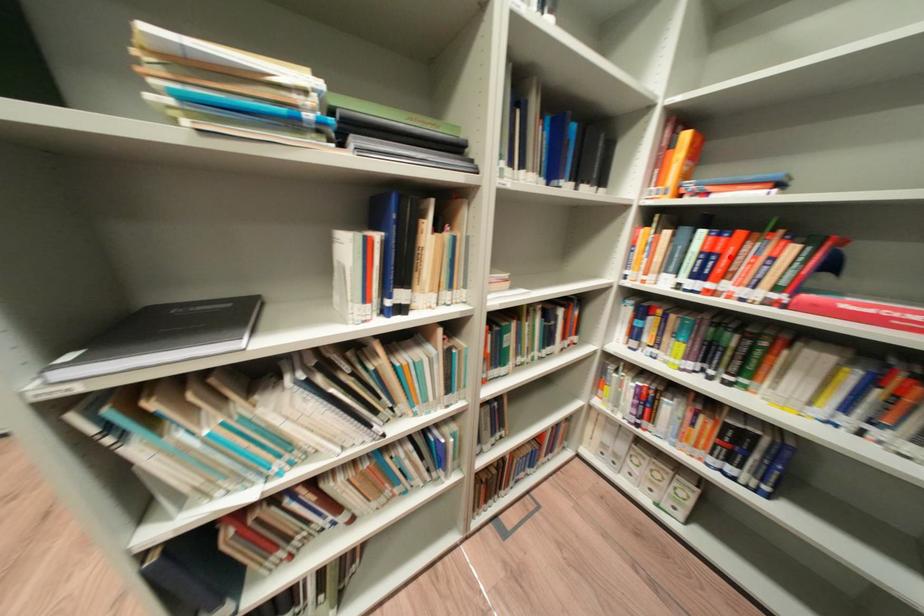
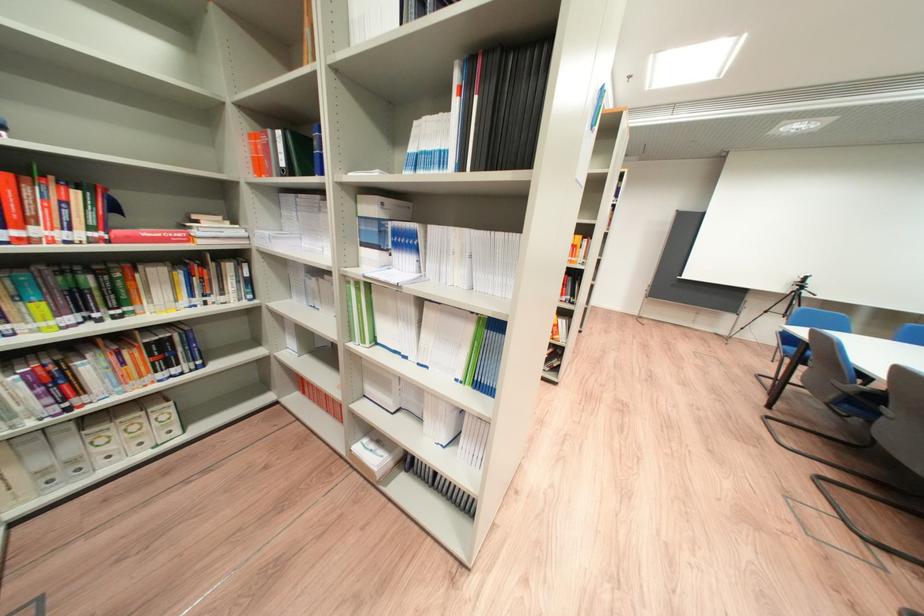
Where in the second image is the point corresponding to the highlighted location from the first image?

(9, 201)